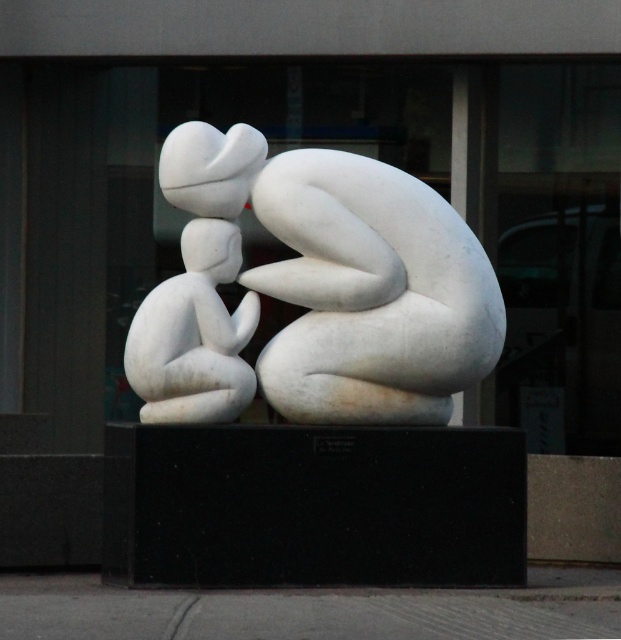
You are an art curator planning to install a new lighting system for the exhibition. You need to ensure that the white marble sculpture at center and the white matte stone child at left are both clearly visible. Given their positions, which object might require additional lighting to avoid blending into the background?

The white marble sculpture at center is positioned over the white matte stone child at left. Since the sculpture is above the child, the child at left may be in the shadow cast by the sculpture, so additional lighting should be directed towards the white matte stone child at left to ensure it remains visible.

You are an art curator planning to display the white marble sculpture at center and the white matte stone child at left in a gallery. The gallery has a narrow corridor that can only accommodate items up to 1.2 meters wide. Which of the two objects would you choose to display in the corridor to ensure it fits without modification?

The white marble sculpture at center is wider than the white matte stone child at left, so the white matte stone child at left should be displayed in the corridor to ensure it fits within the 1.2 meters width restriction.

You are an art curator planning to display the white marble sculpture at center and the white matte stone child at left in a gallery. Considering their heights, which object should be placed on a taller pedestal to ensure both are visible from the front row seats?

The white marble sculpture at center should be placed on a taller pedestal because it has a greater height compared to the white matte stone child at left, ensuring visibility from the front row seats.